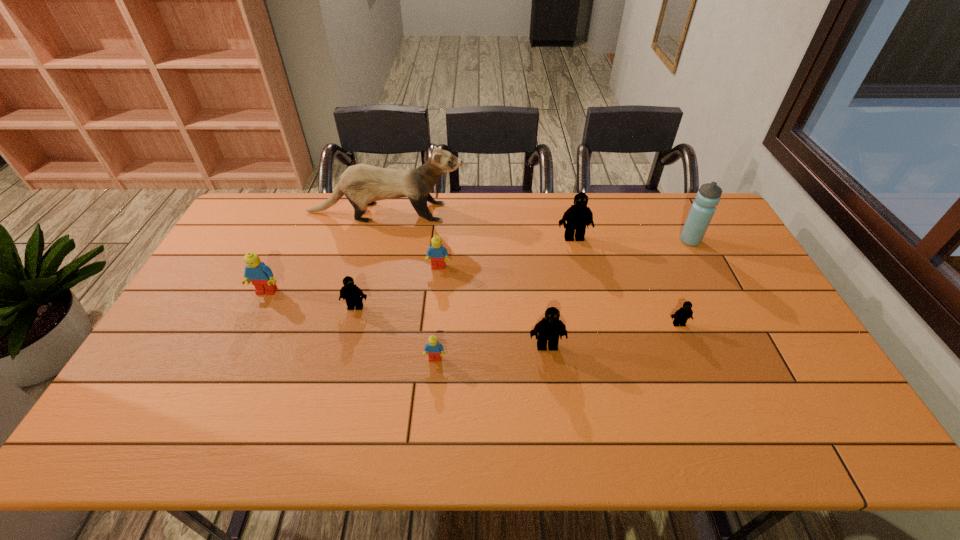
Locate an element on the screen. This screenshot has width=960, height=540. gray ferret is located at coordinates (362, 184).

Locate an element on the screen. ferret is located at coordinates (362, 184).

Find the location of a particular element. water bottle is located at coordinates (702, 210).

Where is `the farthest black Lego`? the farthest black Lego is located at coordinates (577, 216).

Locate an element on the screen. the sixth Lego from left to right is located at coordinates (577, 216).

At what (x,y) coordinates should I click in order to perform the action: click on the leftmost blue Lego. Please return your answer as a coordinate pair (x, y). The image size is (960, 540). Looking at the image, I should click on (261, 276).

I want to click on the fifth nearest Lego, so click(261, 276).

Locate an element on the screen. the fifth Lego from left to right is located at coordinates (549, 328).

I want to click on the sixth farthest Lego, so click(x=549, y=328).

In order to click on the second smallest black Lego in this screenshot , I will do `click(350, 292)`.